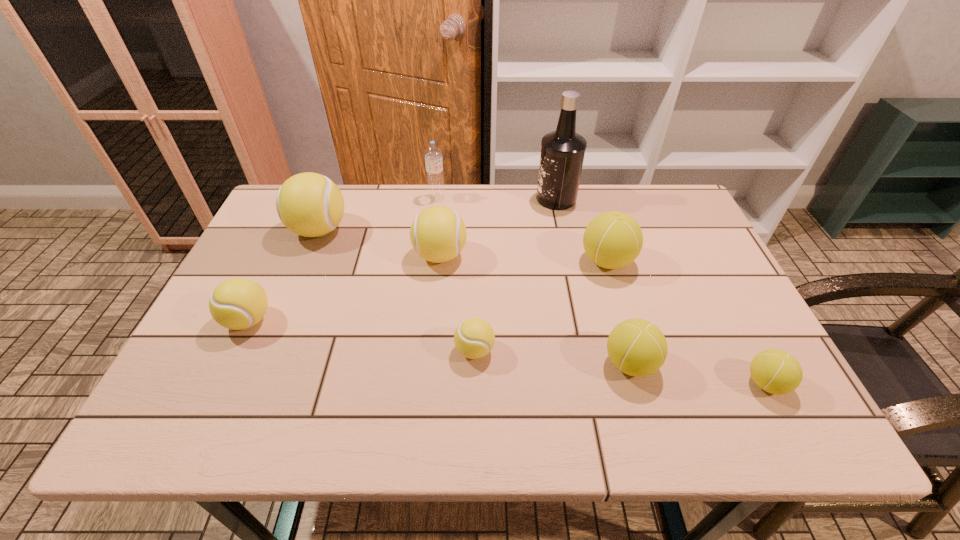
You are a GUI agent. You are given a task and a screenshot of the screen. Output one action in this format:
    pyautogui.click(x=<x>, y=<y>)
    Task: Click on the rightmost object
    The image size is (960, 540).
    Given the screenshot: What is the action you would take?
    pos(775,371)

Where is `vacant area located on the front label of the black liquor`? This screenshot has height=540, width=960. vacant area located on the front label of the black liquor is located at coordinates (464, 199).

You are a GUI agent. You are given a task and a screenshot of the screen. Output one action in this format:
    pyautogui.click(x=<x>, y=<y>)
    Task: Click on the vacant space situated 0.230m on the front label of the black liquor
    The height and width of the screenshot is (540, 960).
    Given the screenshot: What is the action you would take?
    pyautogui.click(x=464, y=199)

This screenshot has width=960, height=540. What are the coordinates of `free space located on the front label of the black liquor` in the screenshot? It's located at (432, 199).

You are a GUI agent. You are given a task and a screenshot of the screen. Output one action in this format:
    pyautogui.click(x=<x>, y=<y>)
    Task: Click on the free region located on the right of the water bottle
    Image resolution: width=960 pixels, height=540 pixels.
    Given the screenshot: What is the action you would take?
    pyautogui.click(x=470, y=198)

You are a GUI agent. You are given a task and a screenshot of the screen. Output one action in this format:
    pyautogui.click(x=<x>, y=<y>)
    Task: Click on the vacant space located 0.180m on the right of the biggest yellow tennis ball
    Image resolution: width=960 pixels, height=540 pixels.
    Given the screenshot: What is the action you would take?
    pyautogui.click(x=411, y=230)

You are a GUI agent. You are given a task and a screenshot of the screen. Output one action in this format:
    pyautogui.click(x=<x>, y=<y>)
    Task: Click on the free space located on the left of the third smallest yellow tennis ball
    
    Given the screenshot: What is the action you would take?
    pyautogui.click(x=388, y=255)

Where is `vacant space situated on the right of the biggest green tennis ball`? vacant space situated on the right of the biggest green tennis ball is located at coordinates (657, 261).

The image size is (960, 540). Find the location of `vacant space located 0.350m on the right of the second smallest yellow tennis ball`. vacant space located 0.350m on the right of the second smallest yellow tennis ball is located at coordinates (420, 320).

Find the location of a particular element. Image resolution: width=960 pixels, height=540 pixels. vacant area located 0.130m on the back of the second biggest green tennis ball is located at coordinates (612, 300).